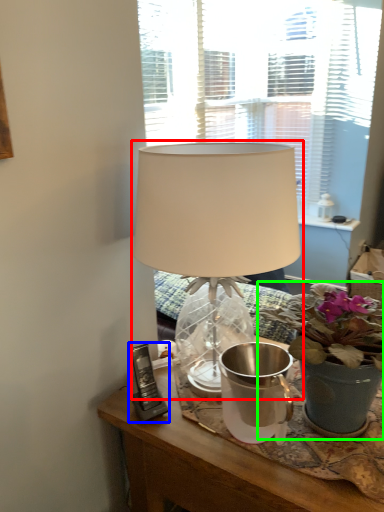
Question: Which object is the farthest from lamp (highlighted by a red box)? Choose among these: gadget (highlighted by a blue box) or houseplant (highlighted by a green box).

Choices:
 (A) gadget
 (B) houseplant

Answer: (A)